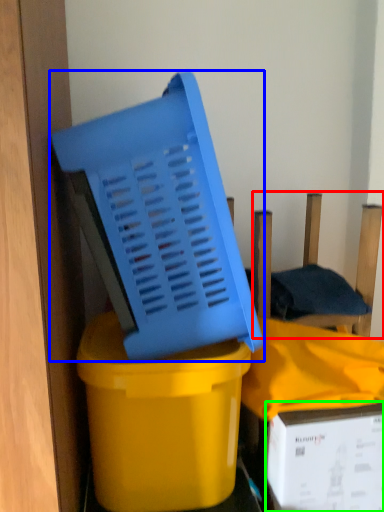
Question: Which object is the farthest from chair (highlighted by a red box)? Choose among these: basket (highlighted by a blue box) or box (highlighted by a green box).

Choices:
 (A) basket
 (B) box

Answer: (B)